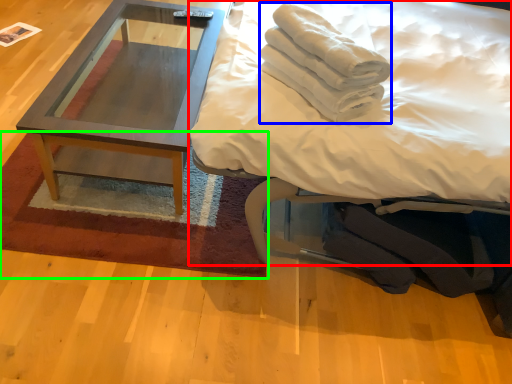
Question: Which object is the closest to the bed (highlighted by a red box)? Choose among these: material (highlighted by a blue box) or mat (highlighted by a green box).

Choices:
 (A) material
 (B) mat

Answer: (A)